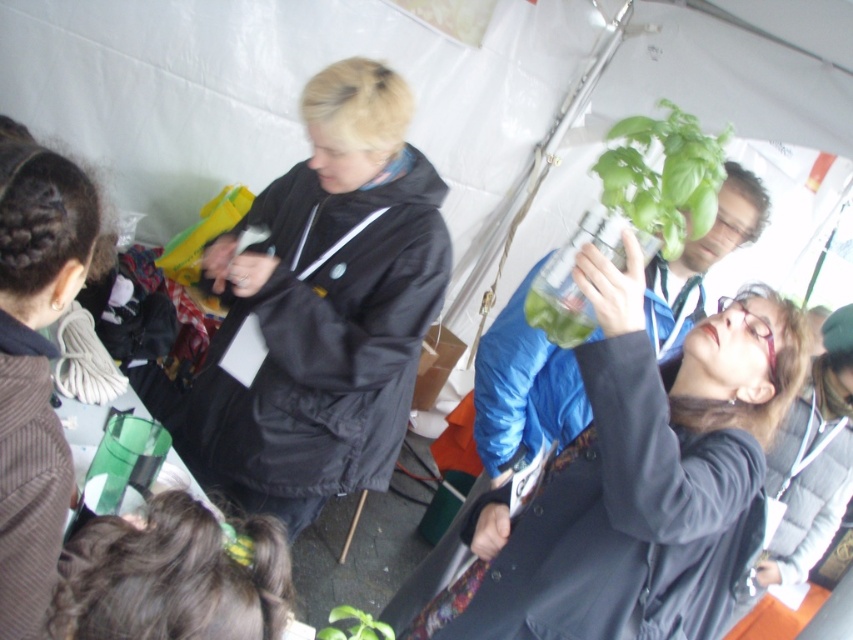
You are at the entrance of the tent and want to locate the person wearing the black matte jacket at center. According to the spatial coordinates provided, where should you look relative to your current position?

The black matte jacket at center is located at point 0.483 on the horizontal axis and 0.380 on the vertical axis relative to your position at the entrance. To locate it, move forward approximately 38.0 percent of the tent depth and center yourself horizontally at 48.3 percent from the left edge.

You are organizing a workshop and need to arrange seating. The black matte jacket at center and dark brown hair at lower left are both attending. Which attendee requires a larger chair based on their size?

The black matte jacket at center requires a larger chair because it has a larger size compared to the dark brown hair at lower left according to the description.